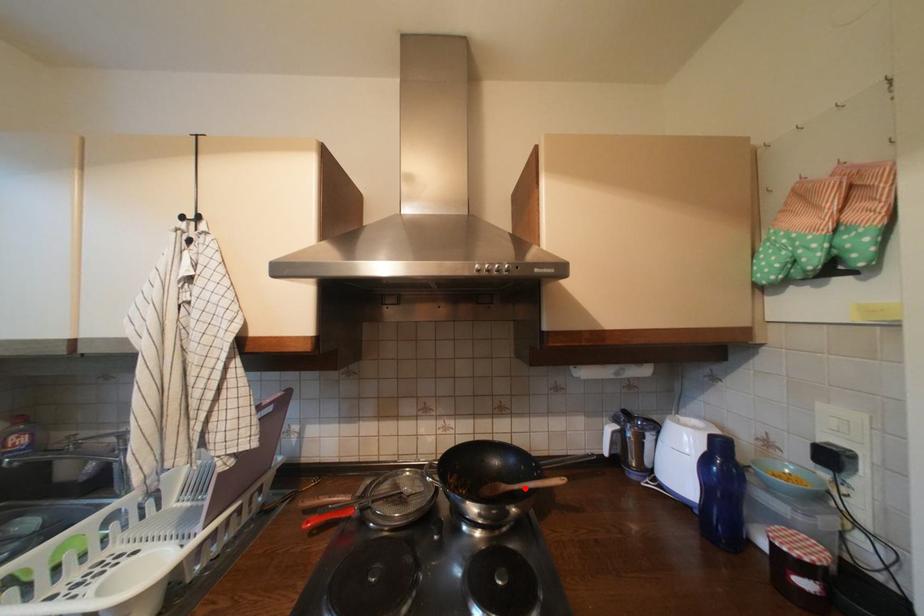
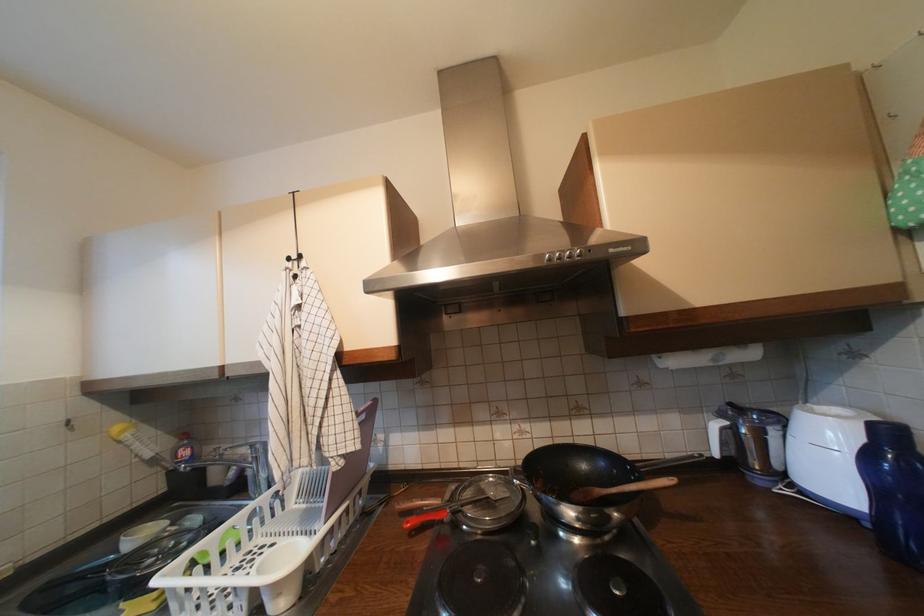
The point at the highlighted location is marked in the first image. Where is the corresponding point in the second image?

(623, 492)